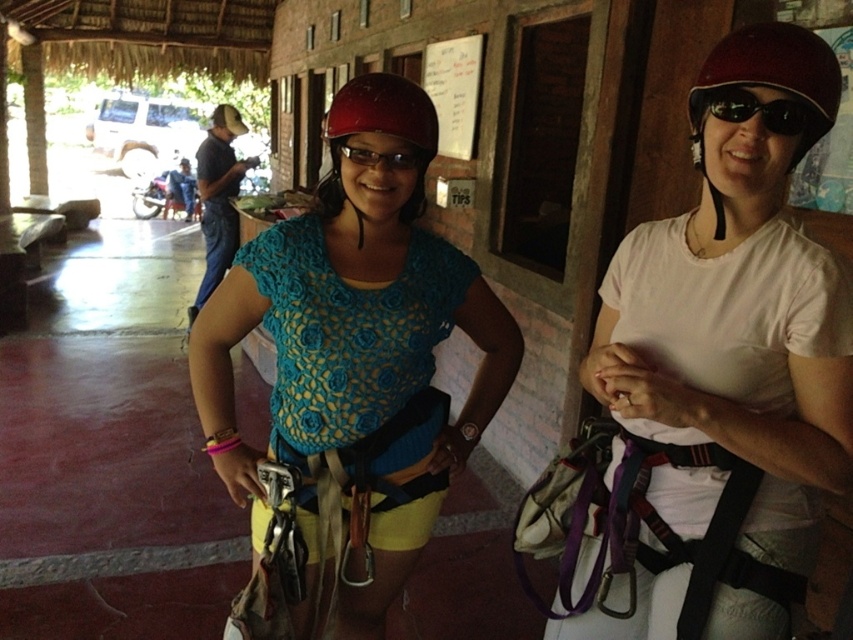
Question: Which of these objects is positioned closest to the maroon matte helmet at upper right?

Choices:
 (A) white paper at upper center
 (B) white matte helmet at center
 (C) black plastic goggles at upper right

Answer: (C)

Question: Is white matte helmet at center above white paper at upper center?

Choices:
 (A) yes
 (B) no

Answer: (B)

Question: Does matte blue shirt at center have a larger size compared to matte black goggles at center?

Choices:
 (A) no
 (B) yes

Answer: (B)

Question: Can you confirm if white matte helmet at center is positioned to the left of maroon matte helmet at upper right?

Choices:
 (A) yes
 (B) no

Answer: (A)

Question: Which object appears farthest from the camera in this image?

Choices:
 (A) matte black goggles at center
 (B) black plastic goggles at upper right
 (C) white matte helmet at center

Answer: (A)

Question: Which of the following is the closest to the observer?

Choices:
 (A) maroon matte helmet at upper right
 (B) matte blue shirt at center

Answer: (A)